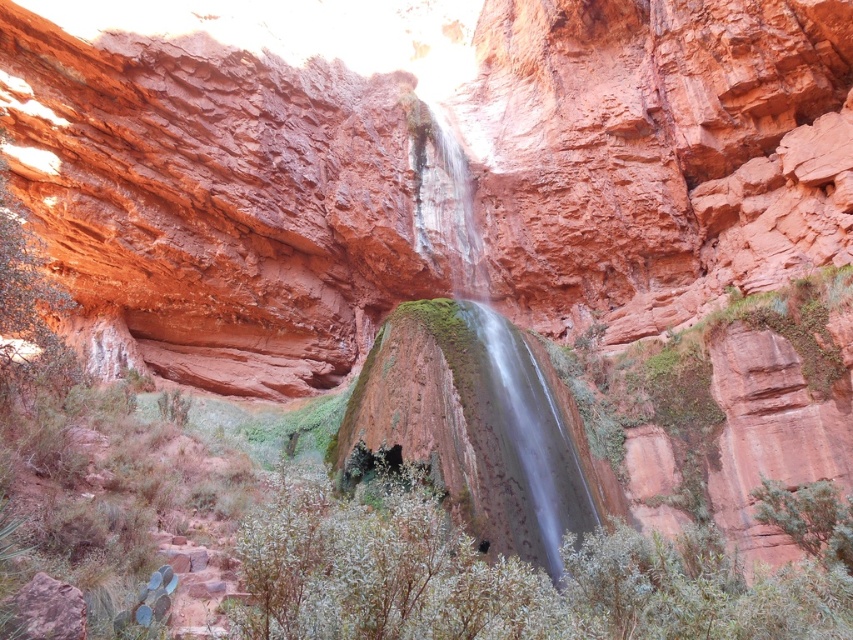
Question: Is the position of green leafy shrubs at center less distant than that of smooth rock waterfall at center?

Choices:
 (A) yes
 (B) no

Answer: (A)

Question: Is green leafy shrubs at center smaller than smooth rock waterfall at center?

Choices:
 (A) no
 (B) yes

Answer: (B)

Question: Which of the following is the farthest from the observer?

Choices:
 (A) (315, 500)
 (B) (457, 154)

Answer: (B)

Question: Which point is farther to the camera?

Choices:
 (A) pos(329,593)
 (B) pos(451,278)

Answer: (B)

Question: Is green leafy shrubs at center above smooth rock waterfall at center?

Choices:
 (A) no
 (B) yes

Answer: (A)

Question: Which point is farther to the camera?

Choices:
 (A) green leafy shrubs at center
 (B) smooth rock waterfall at center

Answer: (B)